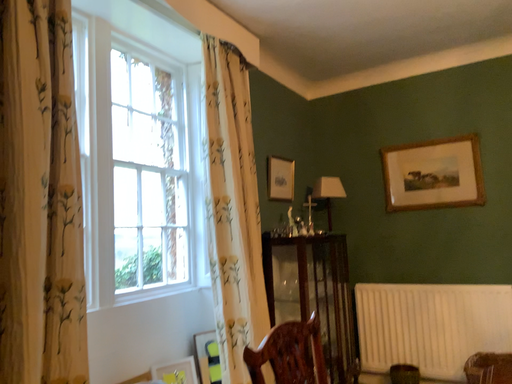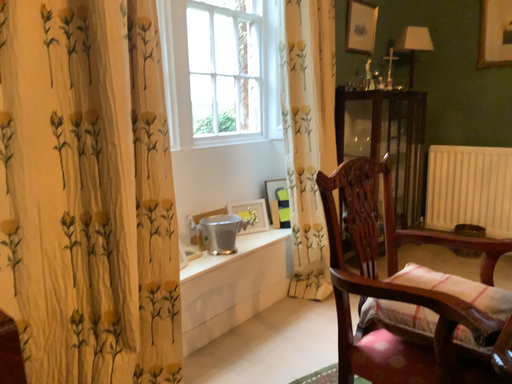
Question: How did the camera likely rotate when shooting the video?

Choices:
 (A) rotated right
 (B) rotated left

Answer: (B)